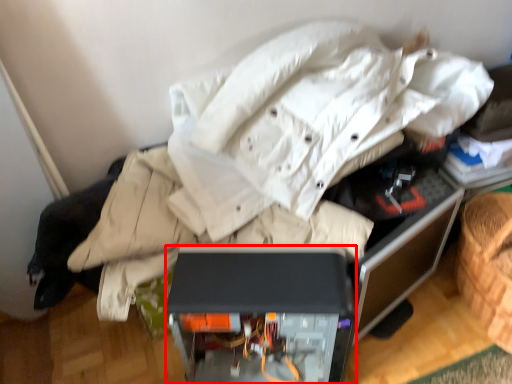
Question: From the image's perspective, what is the correct spatial positioning of furniture (annotated by the red box) in reference to computer desk?

Choices:
 (A) below
 (B) above

Answer: (B)